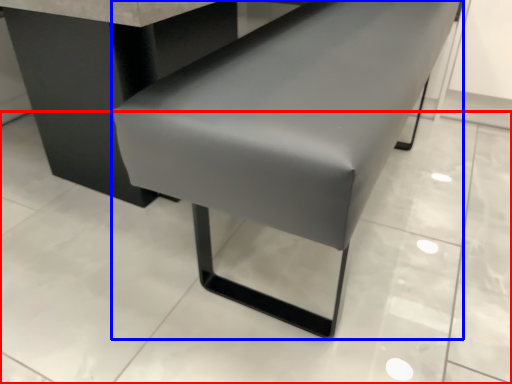
Question: Which object is further to the camera taking this photo, concrete (highlighted by a red box) or furniture (highlighted by a blue box)?

Choices:
 (A) concrete
 (B) furniture

Answer: (A)